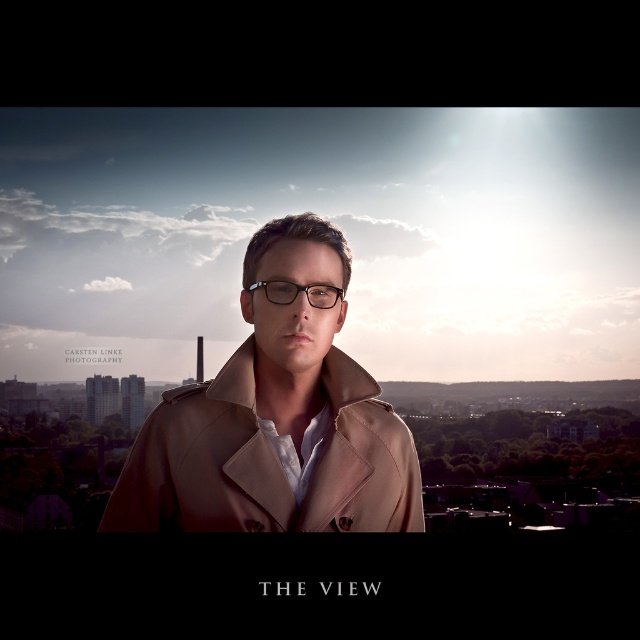
Is point (376, 454) closer to camera compared to point (248, 291)?

Yes.

Is point (192, 513) farther from camera compared to point (266, 280)?

No, (192, 513) is closer to viewer.

The image size is (640, 640). What are the coordinates of `tan leather trench coat at center` in the screenshot? It's located at (268, 461).